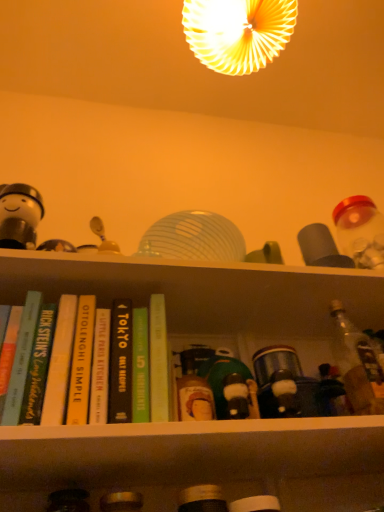
The height and width of the screenshot is (512, 384). I want to click on vacant area situated to the left side of clear glass bottle at right, the first bottle positioned from the top, so click(330, 429).